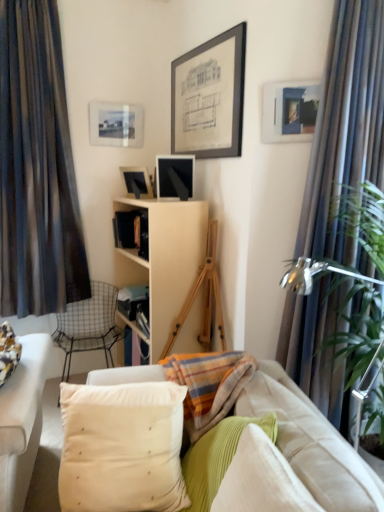
Question: Which direction should I rotate to face matte glass picture frame at upper center, which is the 1th picture frame from left to right, — up or down?

Choices:
 (A) up
 (B) down

Answer: (A)

Question: From a real-world perspective, is green corduroy pillow at center, which is the 2th pillow from right to left, physically above matte blue picture frame at upper right, the 2th picture frame when ordered from top to bottom?

Choices:
 (A) no
 (B) yes

Answer: (A)

Question: Is matte blue picture frame at upper right, the first picture frame viewed from the front, inside green corduroy pillow at center, which is the 2th pillow from right to left?

Choices:
 (A) no
 (B) yes

Answer: (A)

Question: Is green corduroy pillow at center, the 2th pillow when ordered from left to right, wider than matte blue picture frame at upper right, the 2th picture frame when ordered from bottom to top?

Choices:
 (A) yes
 (B) no

Answer: (A)

Question: Is green corduroy pillow at center, the 2th pillow when ordered from left to right, not inside matte blue picture frame at upper right, the 2th picture frame when ordered from top to bottom?

Choices:
 (A) yes
 (B) no

Answer: (A)

Question: Considering the relative sizes of green corduroy pillow at center, the 2th pillow when ordered from left to right, and matte blue picture frame at upper right, which ranks as the third picture frame in back-to-front order, in the image provided, is green corduroy pillow at center, the 2th pillow when ordered from left to right, bigger than matte blue picture frame at upper right, which ranks as the third picture frame in back-to-front order,?

Choices:
 (A) yes
 (B) no

Answer: (A)

Question: Would you consider green corduroy pillow at center, the 2th pillow when ordered from left to right, to be distant from matte blue picture frame at upper right, which ranks as the third picture frame in back-to-front order?

Choices:
 (A) yes
 (B) no

Answer: (A)

Question: Are metallic wire chair at left and dark striped fabric curtain at left, which appears as the 2th curtain when viewed from the front, making contact?

Choices:
 (A) no
 (B) yes

Answer: (A)

Question: Considering the relative sizes of metallic wire chair at left and dark striped fabric curtain at left, the first curtain positioned from the back, in the image provided, is metallic wire chair at left wider than dark striped fabric curtain at left, the first curtain positioned from the back,?

Choices:
 (A) yes
 (B) no

Answer: (A)

Question: Can you confirm if metallic wire chair at left is shorter than dark striped fabric curtain at left, the 2th curtain viewed from the right?

Choices:
 (A) no
 (B) yes

Answer: (B)

Question: Are metallic wire chair at left and dark striped fabric curtain at left, which appears as the 2th curtain when viewed from the front, located far from each other?

Choices:
 (A) yes
 (B) no

Answer: (B)

Question: From a real-world perspective, does metallic wire chair at left stand above dark striped fabric curtain at left, marked as the first curtain in a left-to-right arrangement?

Choices:
 (A) no
 (B) yes

Answer: (A)

Question: Is metallic wire chair at left at the right side of dark striped fabric curtain at left, the first curtain positioned from the back?

Choices:
 (A) yes
 (B) no

Answer: (A)

Question: From a real-world perspective, is corduroy fabric pillow at lower right, which is the third pillow in left-to-right order, on top of dark striped fabric curtain at left, which appears as the 2th curtain when viewed from the front?

Choices:
 (A) no
 (B) yes

Answer: (A)